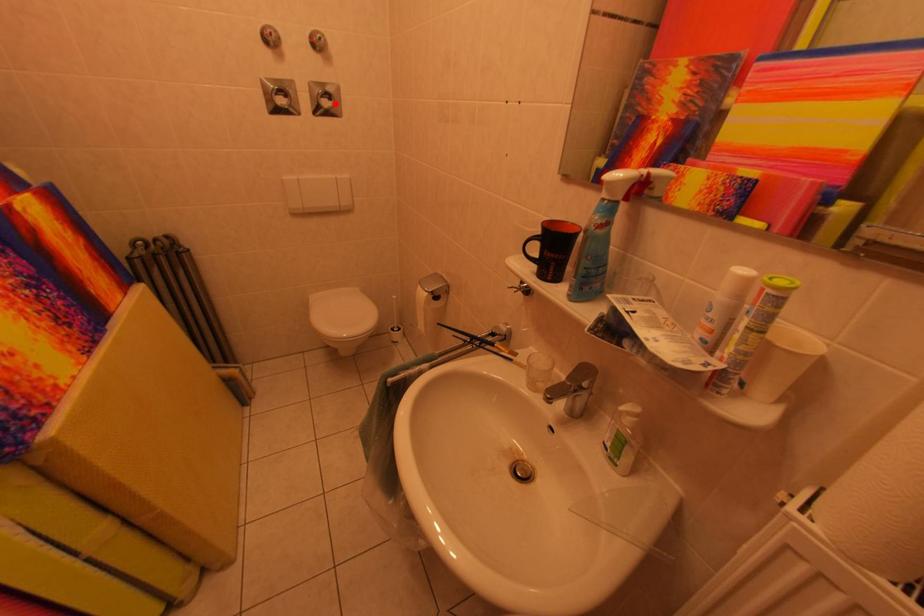
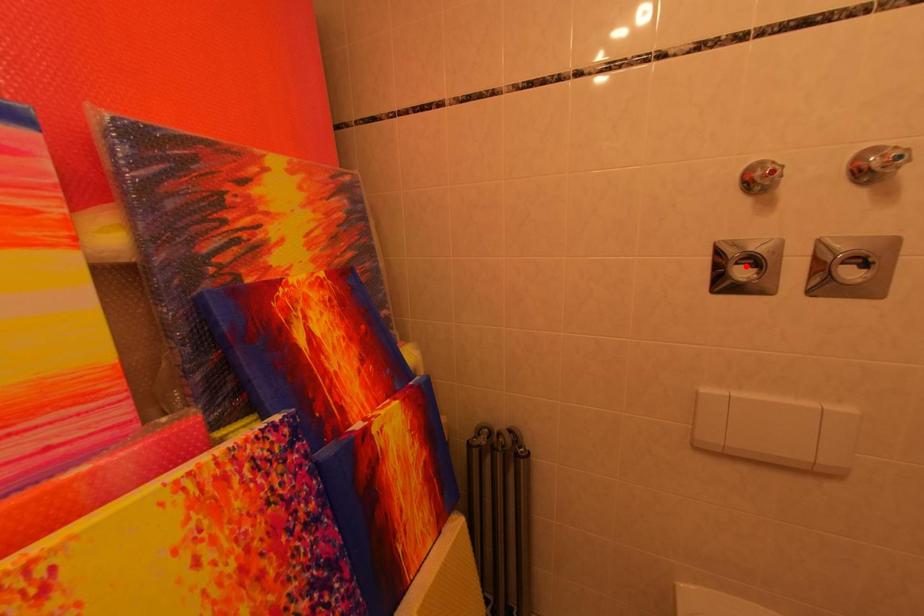
I am providing you with two images of the same scene from different viewpoints. A red point is marked on the first image and another point is marked on the second image. Do the highlighted points in image1 and image2 indicate the same real-world spot?

No